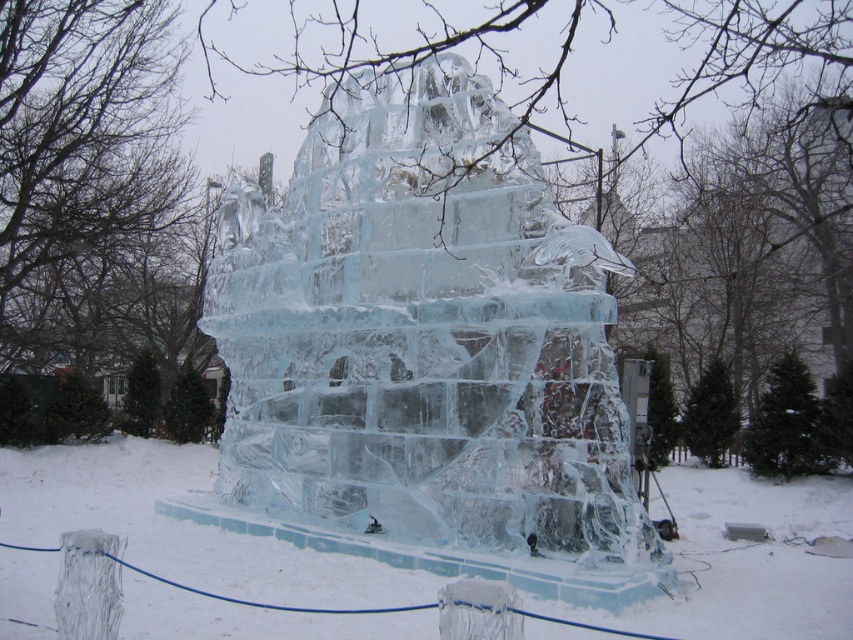
Does clear ice sculpture at center have a lesser width compared to transparent ice sculpture at center?

Yes, clear ice sculpture at center is thinner than transparent ice sculpture at center.

Who is more distant from viewer, (489, 355) or (408, 628)?

The point (489, 355) is more distant.

The image size is (853, 640). Describe the element at coordinates (422, 337) in the screenshot. I see `clear ice sculpture at center` at that location.

This screenshot has width=853, height=640. I want to click on clear ice sculpture at center, so click(x=422, y=337).